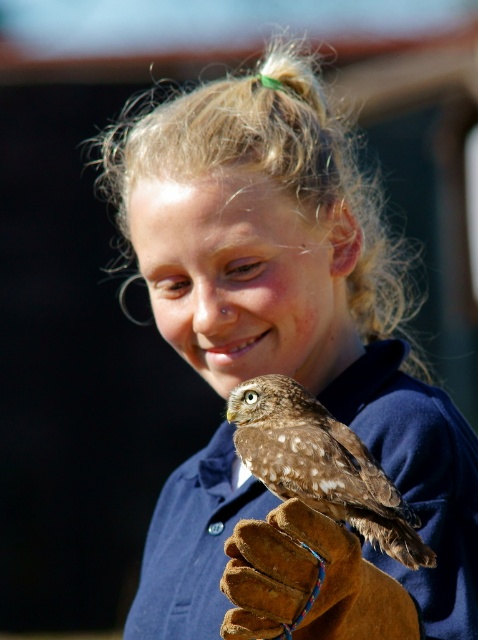
You are a photographer trying to capture a closeup shot of the brown leather glove at lower center and the brown speckled owl at lower center. Since the owl is perched on the glove, which object should you focus on first to ensure both are in focus?

The brown leather glove at lower center has a lesser height compared to brown speckled owl at lower center. To ensure both are in focus, you should focus on the brown leather glove at lower center first since it is closer to the camera.

You are a photographer trying to capture a closeup shot of the brown leather glove at lower center and the brown speckled owl at lower center. Since the owl is perched on the glove, which object should you focus on first to ensure both are in sharp focus?

The brown leather glove at lower center is smaller than the brown speckled owl at lower center, so you should focus on the larger brown speckled owl at lower center first to ensure both are in sharp focus.

You are a photographer trying to capture a closeup shot of the brown speckled owl at lower center. To avoid blocking the owl in your shot, should you position your camera to the left or right side of the brown leather glove at lower center?

The brown leather glove at lower center is positioned on the left side of the brown speckled owl at lower center. To avoid blocking the owl, position your camera to the right side of the brown leather glove at lower center.